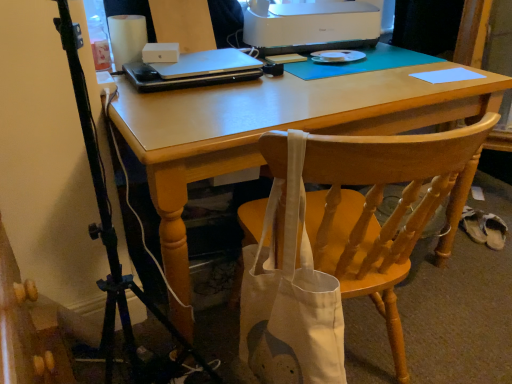
At what (x,y) coordinates should I click in order to perform the action: click on free space on the front side of light blue paper at upper right. Please return your answer as a coordinate pair (x, y). Image resolution: width=512 pixels, height=384 pixels. Looking at the image, I should click on (452, 88).